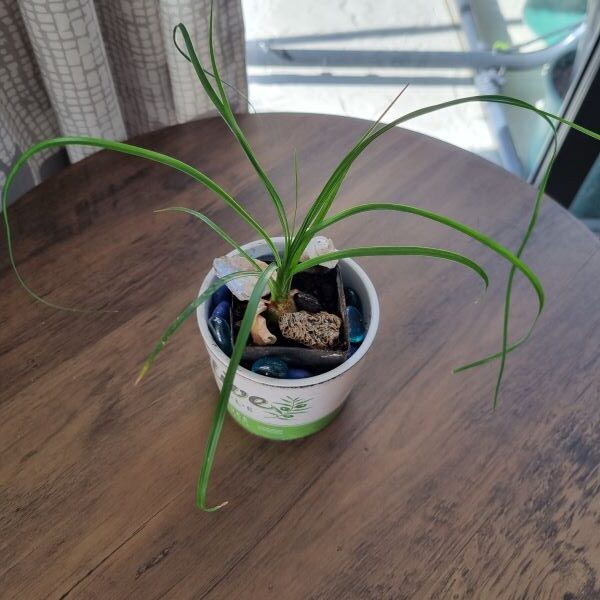
Find the location of a particular element. door frame is located at coordinates (567, 152).